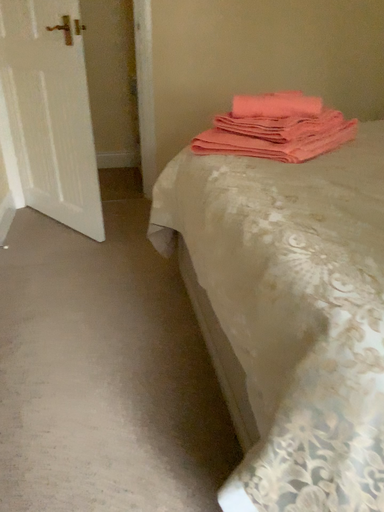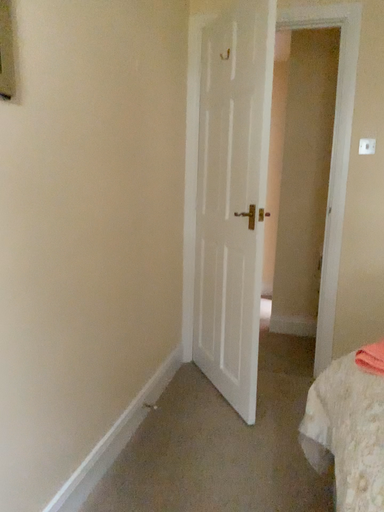
Question: How did the camera likely rotate when shooting the video?

Choices:
 (A) rotated upward
 (B) rotated downward

Answer: (A)